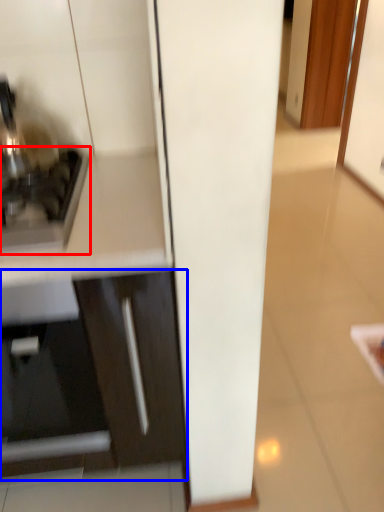
Question: Which object is further to the camera taking this photo, home appliance (highlighted by a red box) or cabinetry (highlighted by a blue box)?

Choices:
 (A) home appliance
 (B) cabinetry

Answer: (A)